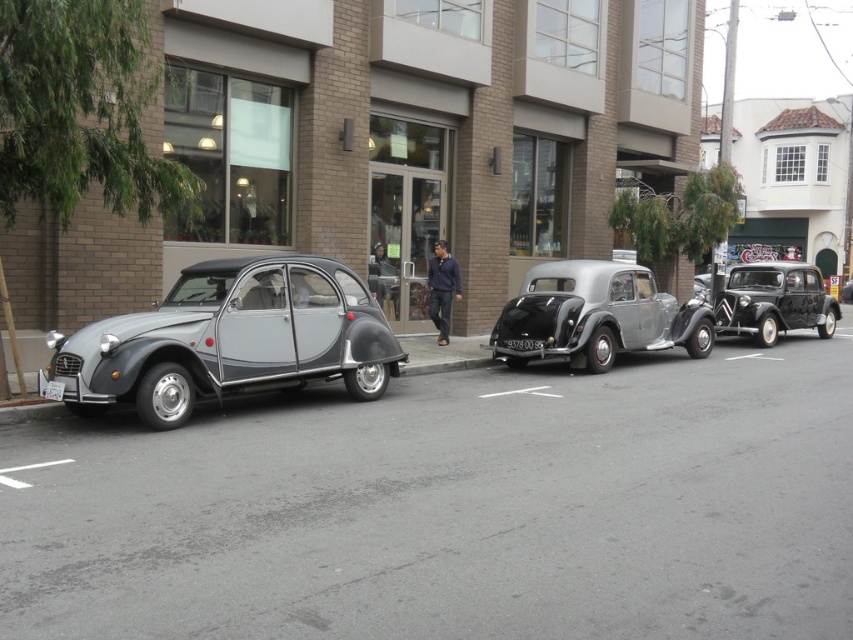
You are a delivery driver who needs to attach a rectangular sticker to the license plate of the car. The sticker is 12 centimeters wide. Which license plate between the black plastic license plate at center and the white plastic license plate at center can the sticker fit on without overlapping?

The sticker can fit on the black plastic license plate at center because its width is larger than the white plastic license plate at center, so it can accommodate the 12 cm wide sticker without overlapping.

You are a delivery person trying to place a large package on the street. The package is taller than the navy blue sweater at center. Can you place it between the black glossy sedan at right and the building without it hitting the sedan?

The black glossy sedan at right is taller than the navy blue sweater at center. Since the package is taller than the navy blue sweater at center, it might still be shorter than the sedan. However, the sedan is taller than the sweater, so the package could fit if it is shorter than the sedan. Without exact measurements, it is uncertain. Please check the height difference between the package and the sedan before placing it.

You are a delivery person trying to park a new car that is exactly the same size as the metallic gray car at left. There is a parking spot marked with a white plastic license plate at center. Can your new car fit in that parking spot?

The metallic gray car at left is larger than the white plastic license plate at center, so the parking spot marked by the white plastic license plate at center may not be large enough to accommodate the new car of the same size as the metallic gray car at left.